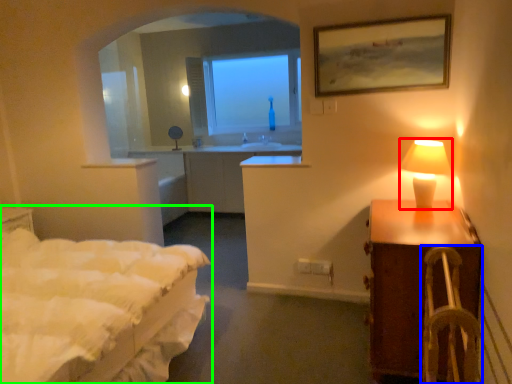
Question: Which object is the farthest from table lamp (highlighted by a red box)? Choose among these: armchair (highlighted by a blue box) or bed (highlighted by a green box).

Choices:
 (A) armchair
 (B) bed

Answer: (B)